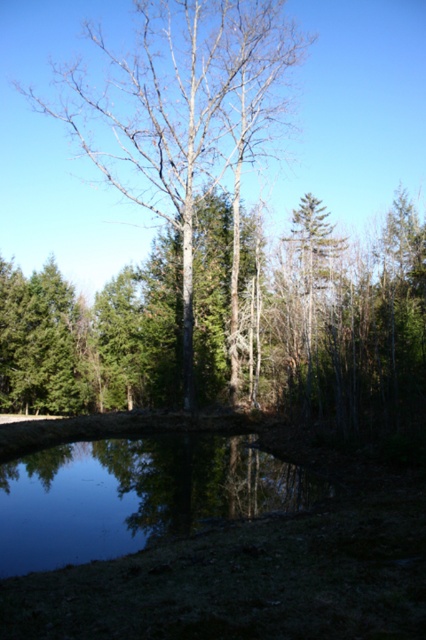
This screenshot has height=640, width=426. What do you see at coordinates (178, 109) in the screenshot?
I see `bare wood tree at center` at bounding box center [178, 109].

Find the location of `bare wood tree at center`. bare wood tree at center is located at coordinates (178, 109).

Who is shorter, green matte tree at center or clear water at center?

Standing shorter between the two is clear water at center.

Which is behind, point (140, 300) or point (259, 513)?

The point (140, 300) is more distant.

The width and height of the screenshot is (426, 640). In order to click on green matte tree at center in this screenshot , I will do `click(337, 323)`.

Based on the photo, between green matte tree at center and bare wood tree at center, which one appears on the right side from the viewer's perspective?

Positioned to the right is green matte tree at center.

Which is behind, point (63, 372) or point (166, 115)?

The point (166, 115) is more distant.

In the scene shown: Who is more forward, (368, 305) or (241, 42)?

Point (368, 305)

What are the coordinates of `green matte tree at center` in the screenshot? It's located at (337, 323).